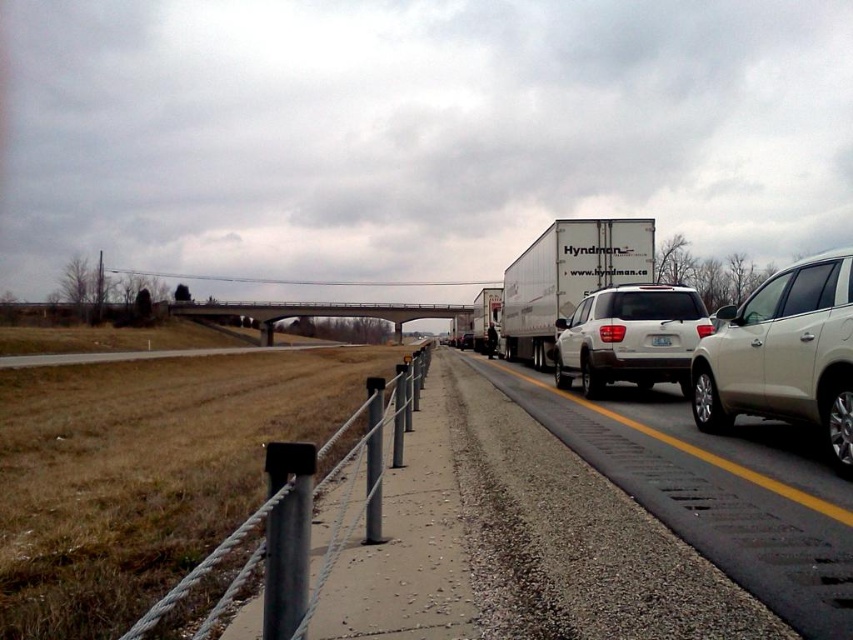
You are a drone operator trying to capture a photo of two specific points on the highway. The first point is labeled as point (x=759, y=422) and the second is point (x=813, y=390). Since you want to focus on the point closer to the camera, which point should you choose?

Point (x=813, y=390) is closer to the camera than point (x=759, y=422), so you should choose point (x=813, y=390) to focus on.